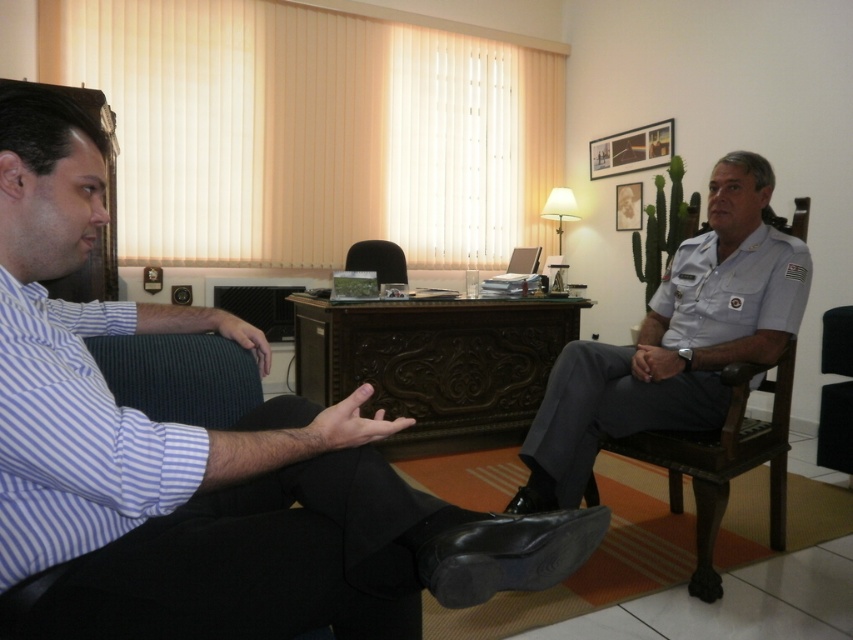
You are planning to place a new plant pot between the matte black suit at left and the black leather armchair at center. According to the scene description, which object should the plant pot be closer to?

The plant pot should be placed closer to the matte black suit at left since it is in front of the black leather armchair at center.

You are a security guard in the office. You need to ensure that people maintain a safe distance of at least 3 feet apart. The two individuals in the scene are the man in the striped light blue shirt and the person in the matte black suit at left. Are they currently maintaining the required distance?

The two individuals are 29.48 inches apart. Since 3 feet equals 36 inches, they are not maintaining the required distance as 29.48 inches is less than 36 inches.

You are planning to place a new plant pot between the light brown wooden armchair at right and the black leather armchair at center. Based on their positions, which chair should the plant pot be closer to?

The light brown wooden armchair at right is to the right of the black leather armchair at center, so the plant pot should be placed closer to the black leather armchair at center to maintain symmetry between the two chairs.